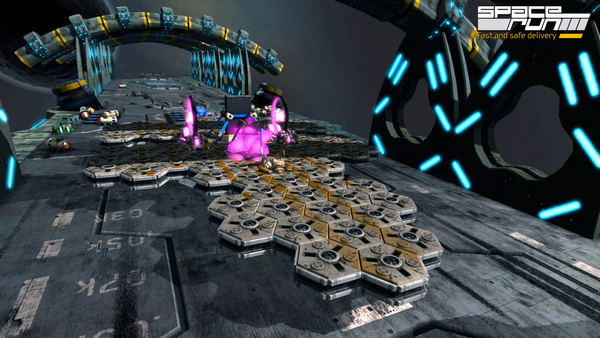
You are a GUI agent. You are given a task and a screenshot of the screen. Output one action in this format:
    pyautogui.click(x=<x>, y=<y>)
    Task: Click on the hole or window
    This screenshot has height=338, width=600.
    Given the screenshot: What is the action you would take?
    pyautogui.click(x=411, y=110), pyautogui.click(x=530, y=139)